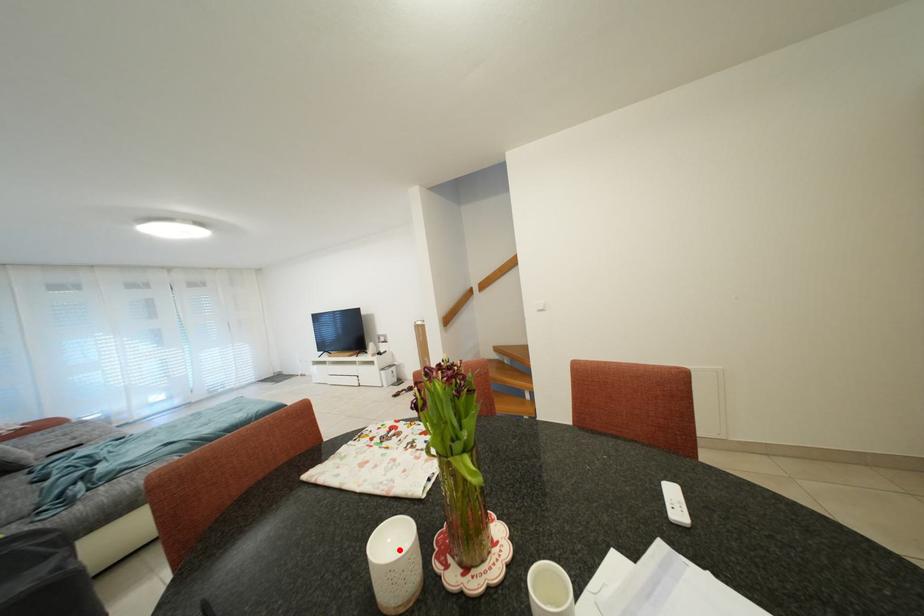
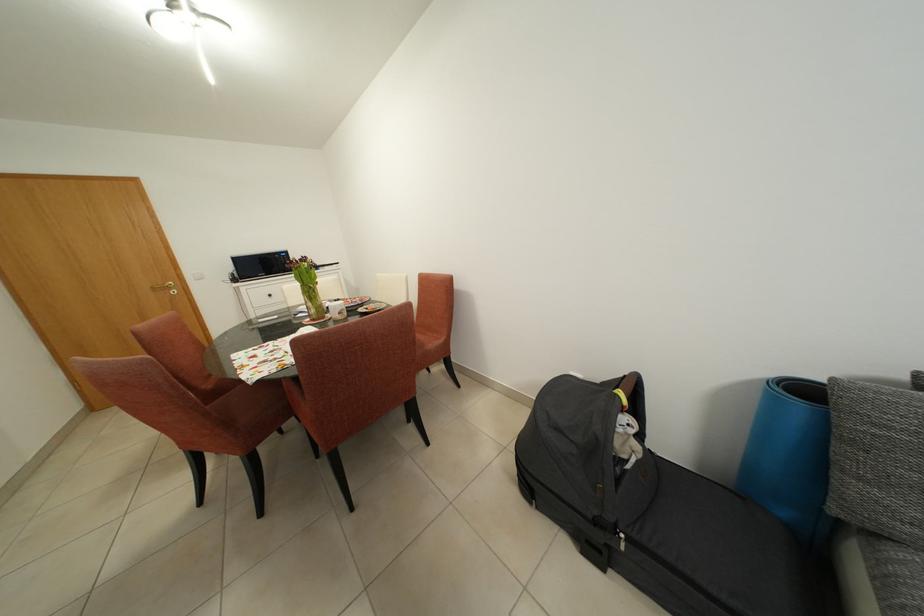
Find the pixel in the second image that matches the highlighted location in the first image.

(345, 307)